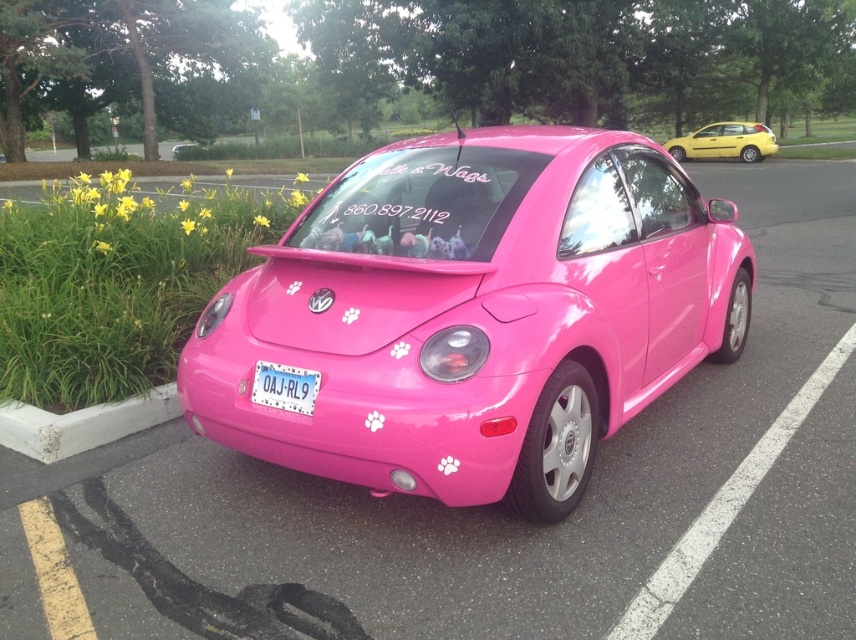
Question: Observing the image, what is the correct spatial positioning of glossy pink car at center in reference to pink plastic license plate at center?

Choices:
 (A) right
 (B) left

Answer: (A)

Question: Is glossy pink car at center thinner than yellow matte hatchback at upper right?

Choices:
 (A) no
 (B) yes

Answer: (B)

Question: Which of the following is the closest to the observer?

Choices:
 (A) (758, 161)
 (B) (152, 417)

Answer: (B)

Question: Does yellow matte hatchback at upper right have a lesser width compared to pink plastic license plate at center?

Choices:
 (A) yes
 (B) no

Answer: (B)

Question: Among these points, which one is farthest from the camera?

Choices:
 (A) (363, 221)
 (B) (64, 426)
 (C) (688, 152)
 (D) (274, 378)

Answer: (C)

Question: Estimate the real-world distances between objects in this image. Which object is farther from the yellow matte hatchback at upper right?

Choices:
 (A) pink plastic license plate at center
 (B) concrete at lower left
 (C) glossy pink car at center

Answer: (A)